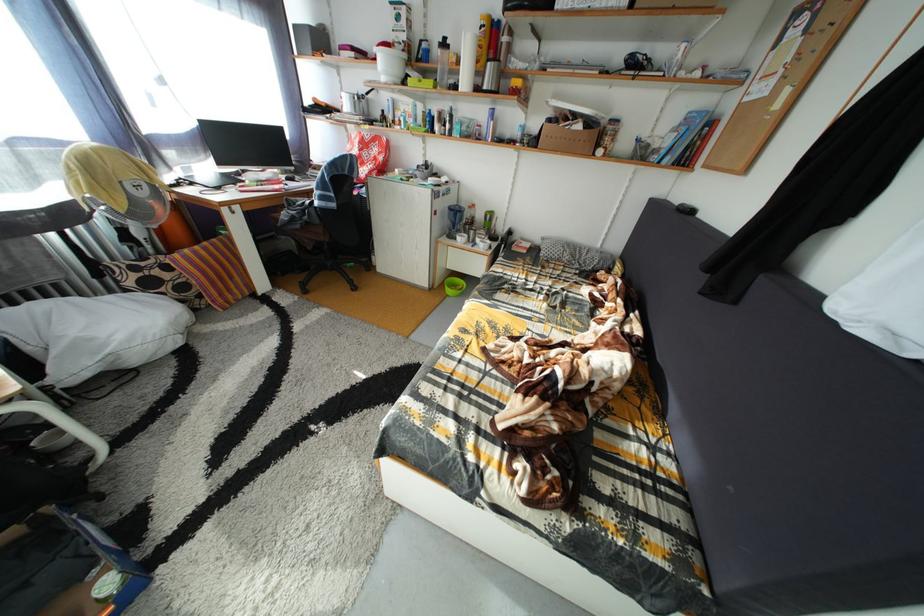
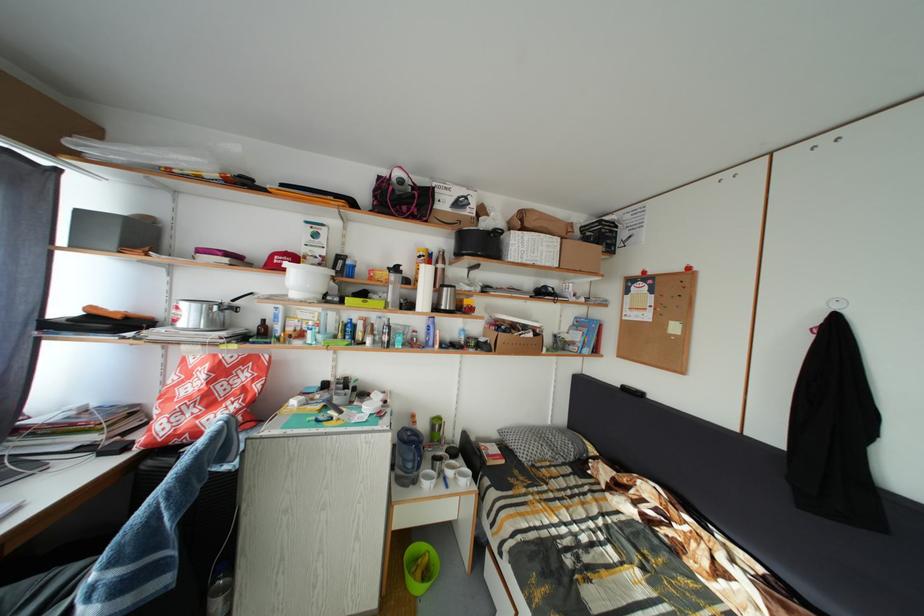
Find the pixel in the second image that matches (588,132) in the first image.

(540, 341)